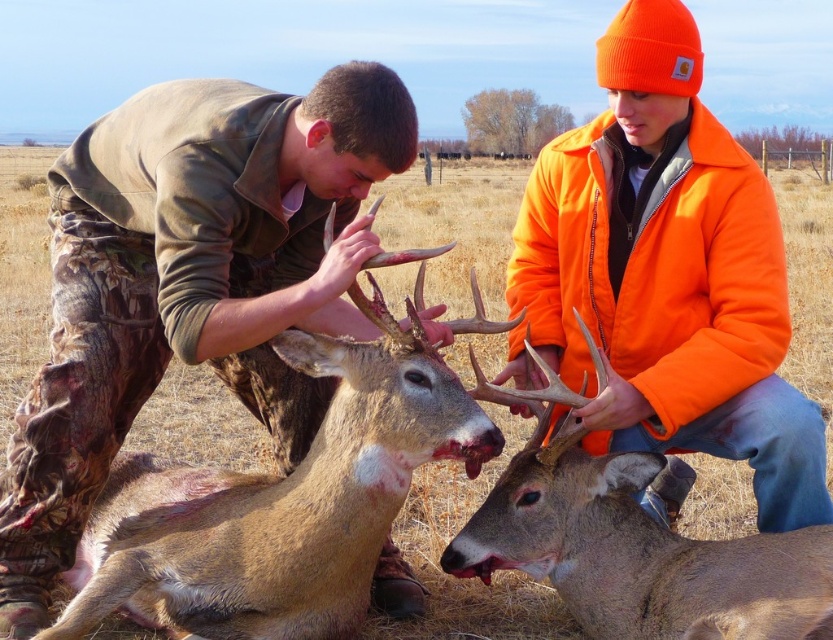
Question: Which point is farther from the camera taking this photo?

Choices:
 (A) (172, 556)
 (B) (822, 602)
 (C) (527, 278)

Answer: (C)

Question: Which point is farther to the camera?

Choices:
 (A) (507, 532)
 (B) (327, 572)
 (C) (634, 19)

Answer: (C)

Question: Among these objects, which one is nearest to the camera?

Choices:
 (A) brown fur deer at center
 (B) brown velvet deer at center

Answer: (A)

Question: In this image, where is orange fleece jacket at upper right located relative to brown velvet deer at center?

Choices:
 (A) below
 (B) above

Answer: (B)

Question: Is orange fleece jacket at upper right behind brown velvet deer at center?

Choices:
 (A) no
 (B) yes

Answer: (B)

Question: Can you confirm if brown fur deer at center is positioned to the right of brown velvet deer at center?

Choices:
 (A) no
 (B) yes

Answer: (A)